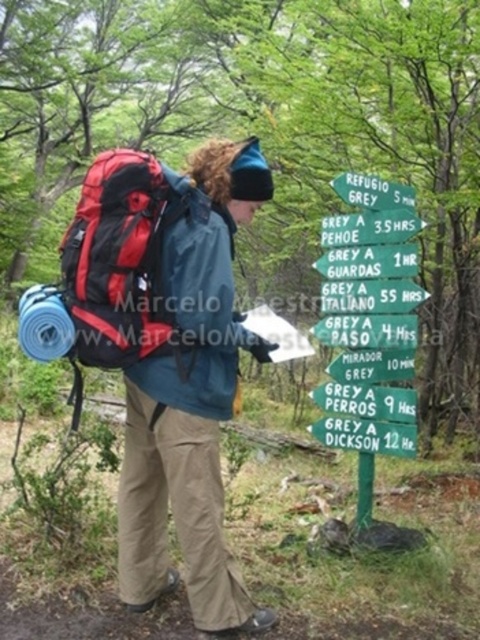
Question: Which object is closer to the camera taking this photo?

Choices:
 (A) red fabric backpack at left
 (B) green wooden signpost at upper center

Answer: (A)

Question: Is green wooden signpost at upper center thinner than red fabric backpack at left?

Choices:
 (A) yes
 (B) no

Answer: (A)

Question: Does green wooden signpost at upper center come behind red fabric backpack at left?

Choices:
 (A) no
 (B) yes

Answer: (B)

Question: Does green wooden signpost at upper center appear over red fabric backpack at left?

Choices:
 (A) no
 (B) yes

Answer: (A)

Question: Among these objects, which one is nearest to the camera?

Choices:
 (A) red fabric backpack at left
 (B) green wooden signpost at upper center

Answer: (A)